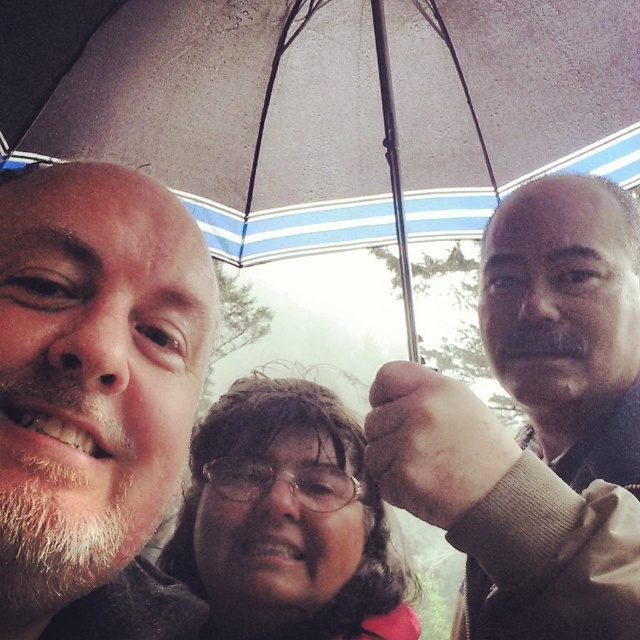
Question: Considering the real-world distances, which object is closest to the matte black glasses at center?

Choices:
 (A) bearded skin at center
 (B) brown matte glasses at center

Answer: (B)

Question: Which object appears farthest from the camera in this image?

Choices:
 (A) brown matte glasses at center
 (B) bearded skin at center

Answer: (A)

Question: Does gray matte jacket at upper right appear under brown matte glasses at center?

Choices:
 (A) no
 (B) yes

Answer: (A)

Question: Can you confirm if brown matte glasses at center is bigger than matte black glasses at center?

Choices:
 (A) yes
 (B) no

Answer: (A)

Question: Which of the following is the farthest from the observer?

Choices:
 (A) (200, 500)
 (B) (579, 282)

Answer: (A)

Question: Observing the image, what is the correct spatial positioning of bearded skin at center in reference to matte black glasses at center?

Choices:
 (A) below
 (B) above

Answer: (B)